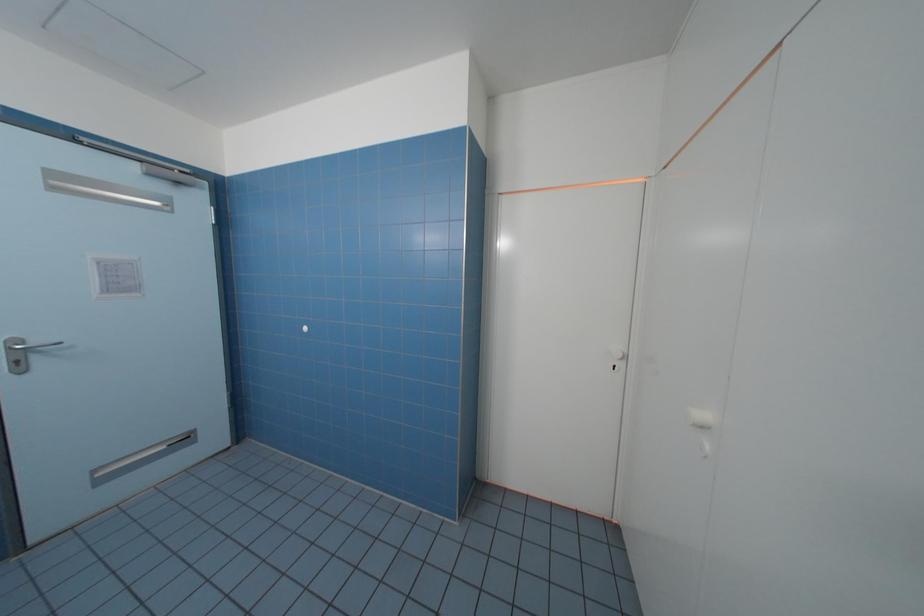
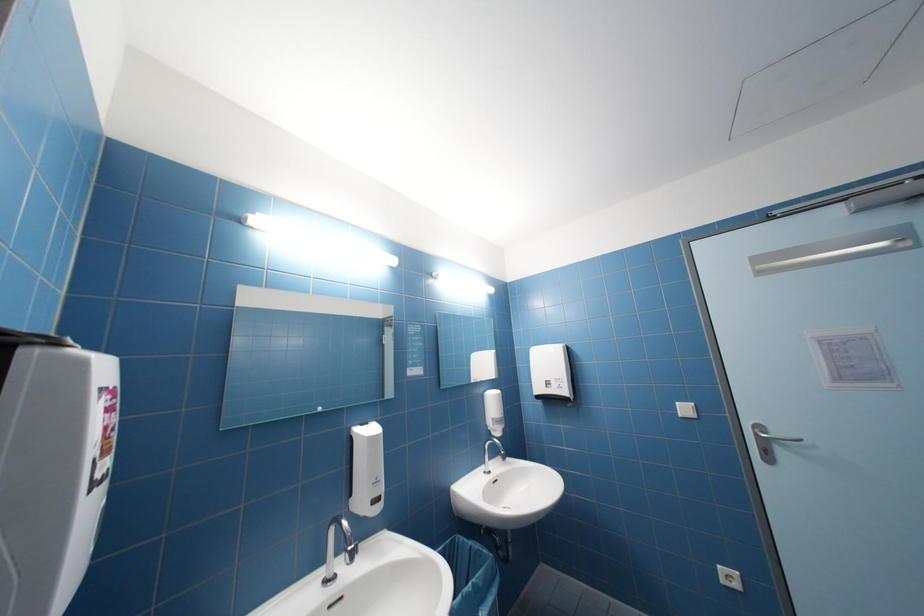
Question: The images are taken continuously from a first-person perspective. In which direction is your viewpoint rotating?

Choices:
 (A) Left
 (B) Right
 (C) Up
 (D) Down

Answer: (A)